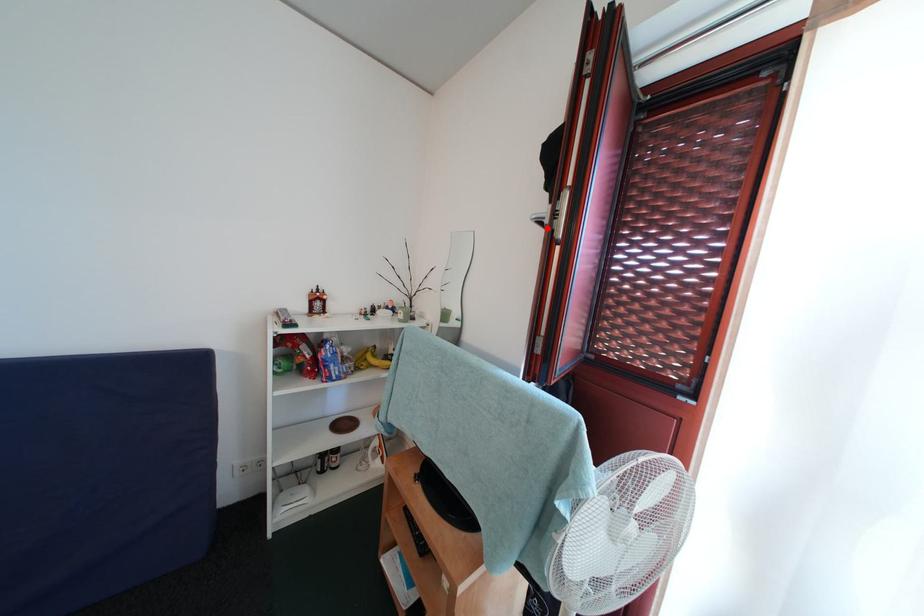
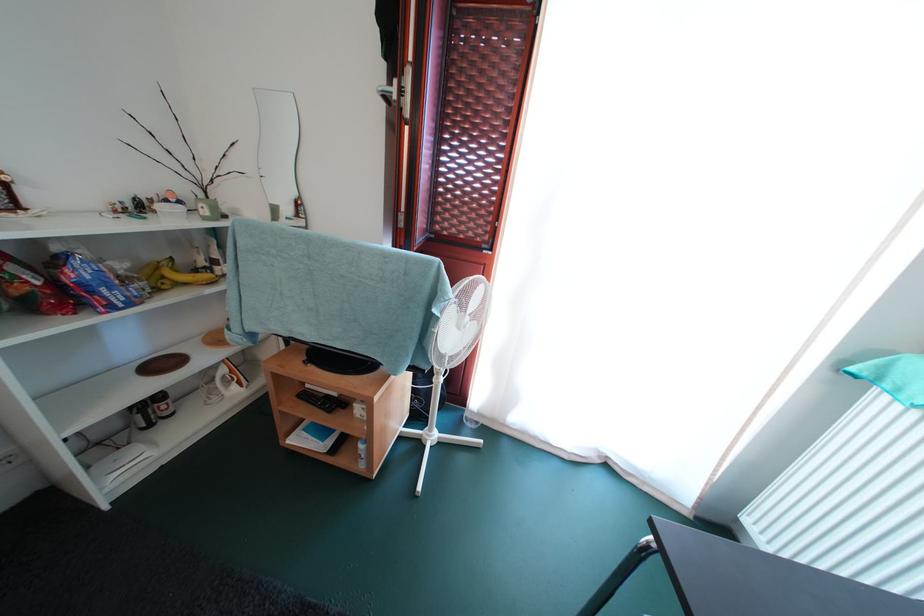
The point at the highlighted location is marked in the first image. Where is the corresponding point in the second image?

(394, 103)